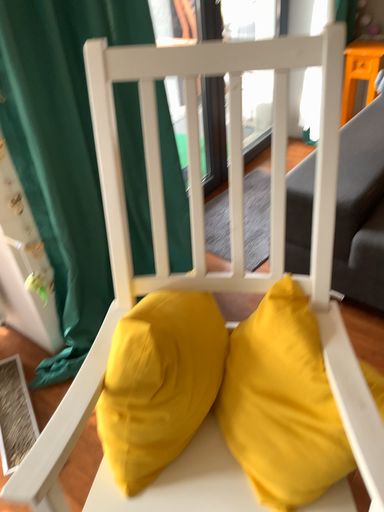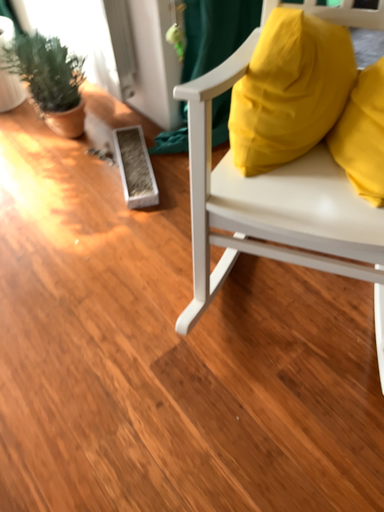
Question: Which way did the camera rotate in the video?

Choices:
 (A) rotated upward
 (B) rotated downward

Answer: (B)